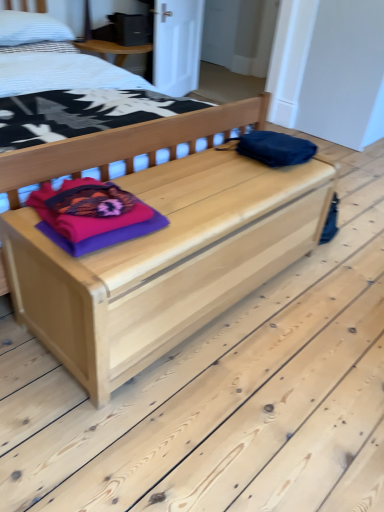
Question: From the image's perspective, is white textured pillow at upper left located beneath natural wood chest at center?

Choices:
 (A) yes
 (B) no

Answer: (B)

Question: Is white textured pillow at upper left not near natural wood chest at center?

Choices:
 (A) no
 (B) yes

Answer: (B)

Question: Is white textured pillow at upper left facing towards natural wood chest at center?

Choices:
 (A) no
 (B) yes

Answer: (A)

Question: Is white textured pillow at upper left oriented away from natural wood chest at center?

Choices:
 (A) yes
 (B) no

Answer: (B)

Question: Considering the relative sizes of white textured pillow at upper left and natural wood chest at center in the image provided, is white textured pillow at upper left taller than natural wood chest at center?

Choices:
 (A) yes
 (B) no

Answer: (B)

Question: Does white textured pillow at upper left appear on the right side of natural wood chest at center?

Choices:
 (A) yes
 (B) no

Answer: (B)

Question: Is purple fabric at center far away from natural wood chest at center?

Choices:
 (A) no
 (B) yes

Answer: (A)

Question: Considering the relative sizes of purple fabric at center and natural wood chest at center in the image provided, is purple fabric at center bigger than natural wood chest at center?

Choices:
 (A) yes
 (B) no

Answer: (B)

Question: Is purple fabric at center outside natural wood chest at center?

Choices:
 (A) no
 (B) yes

Answer: (A)

Question: Does purple fabric at center have a lesser width compared to natural wood chest at center?

Choices:
 (A) yes
 (B) no

Answer: (A)

Question: Is purple fabric at center taller than natural wood chest at center?

Choices:
 (A) yes
 (B) no

Answer: (B)

Question: Is purple fabric at center oriented towards natural wood chest at center?

Choices:
 (A) no
 (B) yes

Answer: (A)

Question: Can you confirm if white textured pillow at upper left is bigger than natural wood bed at center?

Choices:
 (A) yes
 (B) no

Answer: (B)